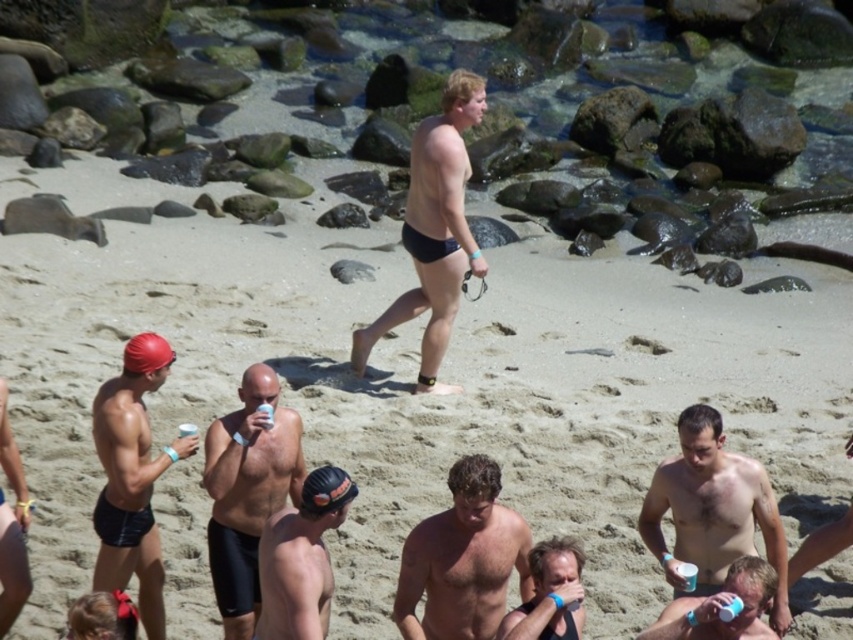
Can you confirm if clear water at center is shorter than matte plastic cup at lower center?

No.

Consider the image. Is clear water at center bigger than matte plastic cup at lower center?

Yes.

Which is behind, point (775, 173) or point (757, 572)?

The point (775, 173) is more distant.

This screenshot has height=640, width=853. Identify the location of clear water at center. (595, 163).

From the picture: Between clear water at center and matte black swim cap at left, which one is positioned lower?

matte black swim cap at left

Is clear water at center below matte black swim cap at left?

No.

Image resolution: width=853 pixels, height=640 pixels. What do you see at coordinates (595, 163) in the screenshot?
I see `clear water at center` at bounding box center [595, 163].

Image resolution: width=853 pixels, height=640 pixels. I want to click on clear water at center, so click(x=595, y=163).

Based on the photo, which is above, black matte swim cap at center or matte black swim cap at lower left?

matte black swim cap at lower left

Between black matte swim cap at center and matte black swim cap at lower left, which one is positioned lower?

Positioned lower is black matte swim cap at center.

Does point (306, 504) come behind point (4, 596)?

No, it is not.

At what (x,y) coordinates should I click in order to perform the action: click on black matte swim cap at center. Please return your answer as a coordinate pair (x, y). This screenshot has height=640, width=853. Looking at the image, I should click on (300, 557).